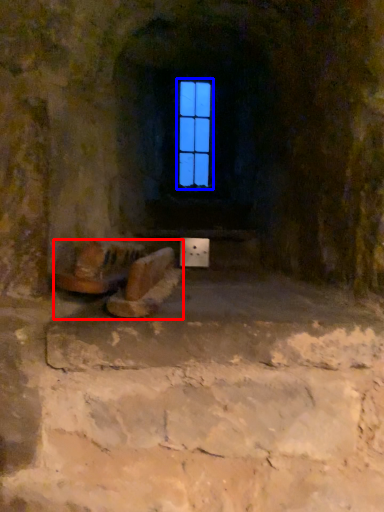
Question: Among these objects, which one is nearest to the camera, furniture (highlighted by a red box) or window (highlighted by a blue box)?

Choices:
 (A) furniture
 (B) window

Answer: (A)